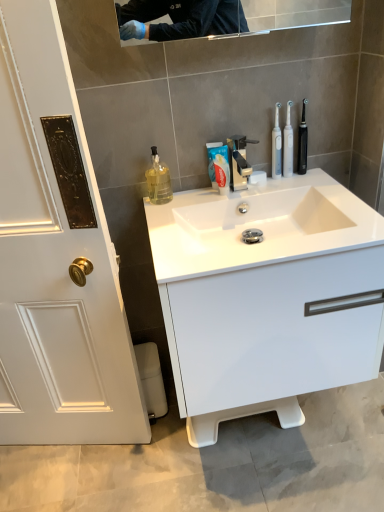
Locate an element on the screen. This screenshot has width=384, height=512. vacant position to the left of polished chrome faucet at center is located at coordinates (194, 203).